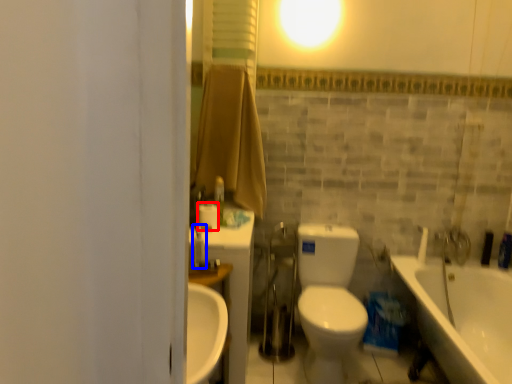
Question: Which of the following is the closest to the observer, toilet paper (highlighted by a red box) or fixture (highlighted by a blue box)?

Choices:
 (A) toilet paper
 (B) fixture

Answer: (B)